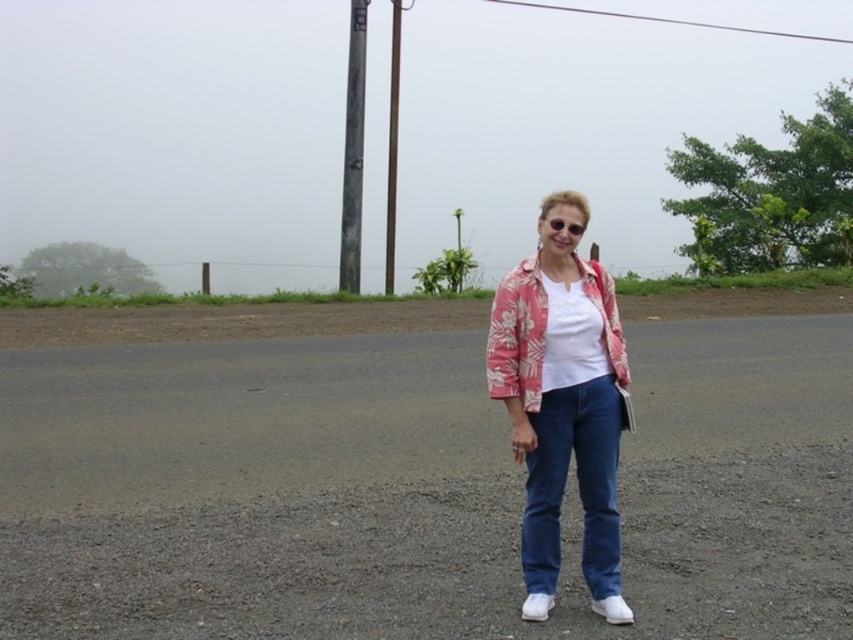
Question: Is the position of pink floral jacket at center more distant than that of clear plastic goggles at center?

Choices:
 (A) no
 (B) yes

Answer: (A)

Question: Is pink floral jacket at center closer to the viewer compared to floral pink fabric jacket at center?

Choices:
 (A) no
 (B) yes

Answer: (A)

Question: Among these points, which one is farthest from the camera?

Choices:
 (A) (393, 99)
 (B) (593, 472)

Answer: (A)

Question: Is denim jeans at center positioned before floral pink fabric jacket at center?

Choices:
 (A) no
 (B) yes

Answer: (B)

Question: Which object is the closest to the pink floral jacket at center?

Choices:
 (A) clear plastic goggles at center
 (B) floral pink fabric jacket at center
 (C) weathered wood pole at upper center
 (D) denim jeans at center

Answer: (D)

Question: Which point is closer to the camera?

Choices:
 (A) (341, 198)
 (B) (511, 289)
 (C) (599, 570)
 (D) (555, 224)

Answer: (B)